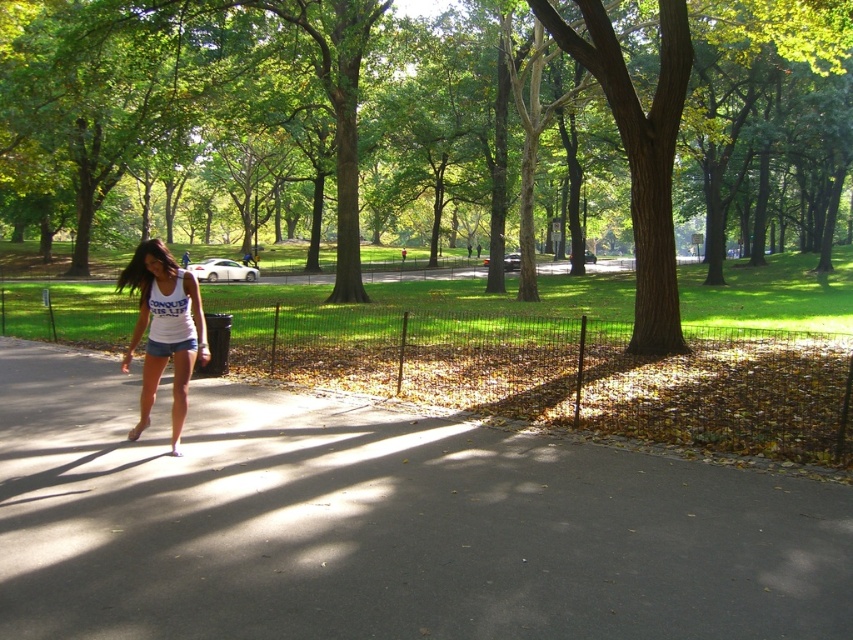
You are standing at the point with coordinates point (164, 321) and want to walk towards the point with coordinates point (370, 625). Which direction should you move relative to your current position?

Since point (370, 625) is closer to the camera than point (164, 321), you should move forward towards it.

You are a park visitor who wants to take a photo of the brown textured tree at center and the gray asphalt pavement at center together in the same frame. Can you stand at a distance where both objects are visible in your camera viewfinder? Explain your reasoning.

The brown textured tree at center and gray asphalt pavement at center are 44.38 meters apart. Since they are relatively far apart, you can likely stand at a distance where both are visible in the camera viewfinder as long as you position yourself appropriately between them or far enough back to capture both in the frame.